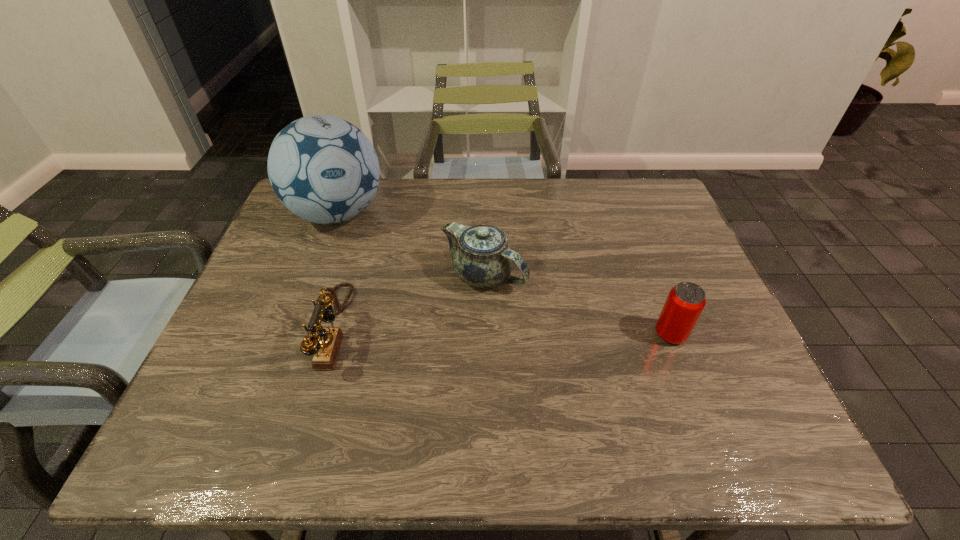
Locate an element on the screen. This screenshot has width=960, height=540. vacant space located 0.240m on the side with brand of the tallest object is located at coordinates (411, 282).

You are a GUI agent. You are given a task and a screenshot of the screen. Output one action in this format:
    pyautogui.click(x=<x>, y=<y>)
    Task: Click on the vacant area situated on the side with brand of the tallest object
    
    Given the screenshot: What is the action you would take?
    pyautogui.click(x=400, y=272)

I want to click on vacant region located 0.090m from the spout of the chinaware, so click(x=534, y=316).

Locate an element on the screen. The image size is (960, 540). vacant space situated 0.050m from the spout of the chinaware is located at coordinates (523, 306).

Locate an element on the screen. Image resolution: width=960 pixels, height=540 pixels. blank area located 0.220m from the spout of the chinaware is located at coordinates (572, 352).

The width and height of the screenshot is (960, 540). What are the coordinates of `object located at the far edge` in the screenshot? It's located at (324, 169).

The height and width of the screenshot is (540, 960). Identify the location of object situated at the near edge. (325, 347).

Find the location of a particular element. This screenshot has width=960, height=540. object that is at the left edge is located at coordinates (324, 169).

This screenshot has width=960, height=540. I want to click on object that is at the right edge, so click(x=685, y=302).

Locate an element on the screen. object present at the far left corner is located at coordinates (324, 169).